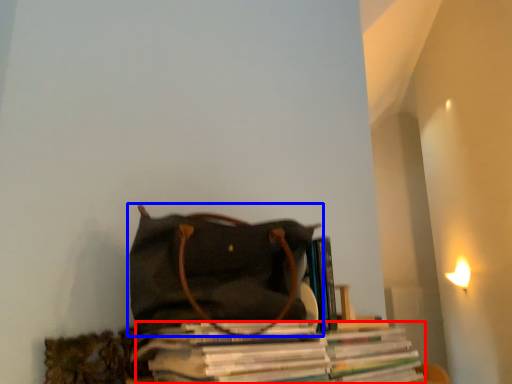
Question: Which object appears closest to the camera in this image, magazine (highlighted by a red box) or handbag (highlighted by a blue box)?

Choices:
 (A) magazine
 (B) handbag

Answer: (A)